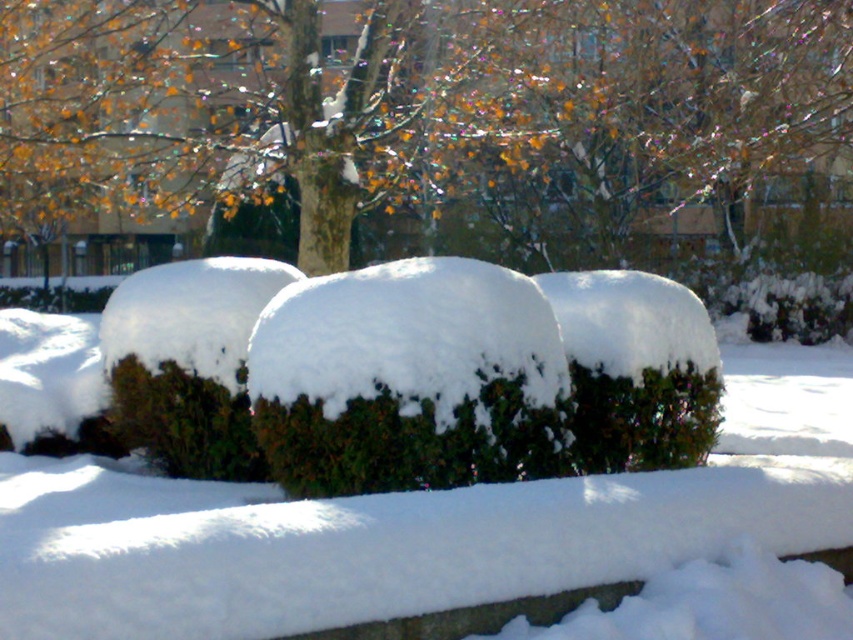
Question: From the image, what is the correct spatial relationship of green leafy tree at center in relation to green matte bush at center?

Choices:
 (A) right
 (B) left

Answer: (A)

Question: Which point is closer to the camera?

Choices:
 (A) (189, 381)
 (B) (300, 51)

Answer: (A)

Question: Can you confirm if green leafy tree at center is smaller than green matte bush at center?

Choices:
 (A) yes
 (B) no

Answer: (B)

Question: Is green leafy tree at center wider than green matte bush at center?

Choices:
 (A) yes
 (B) no

Answer: (A)